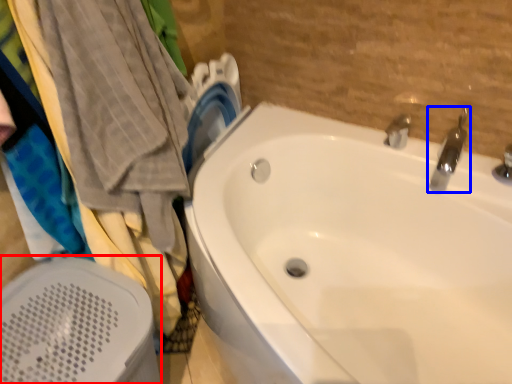
Question: Which object appears closest to the camera in this image, bath heater (highlighted by a red box) or tap (highlighted by a blue box)?

Choices:
 (A) bath heater
 (B) tap

Answer: (A)